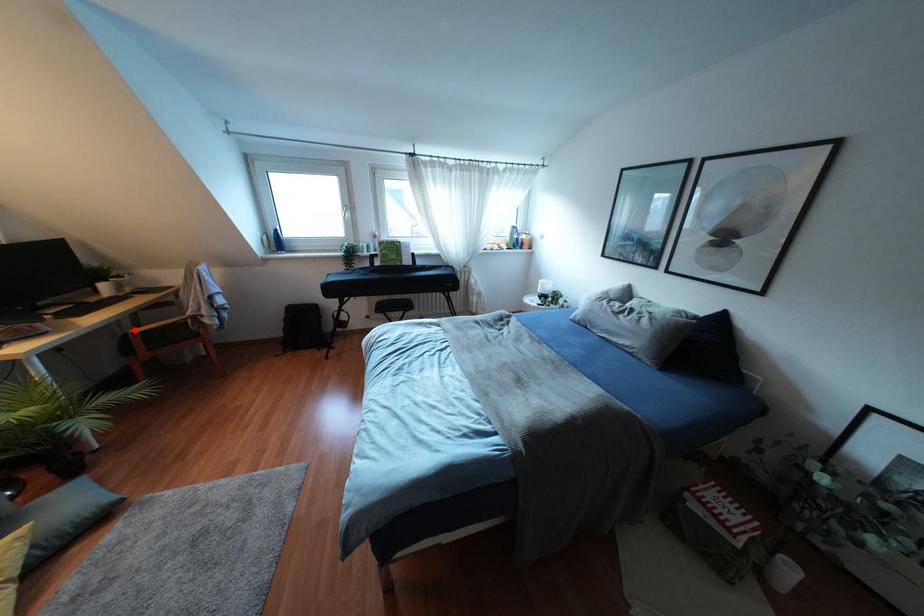
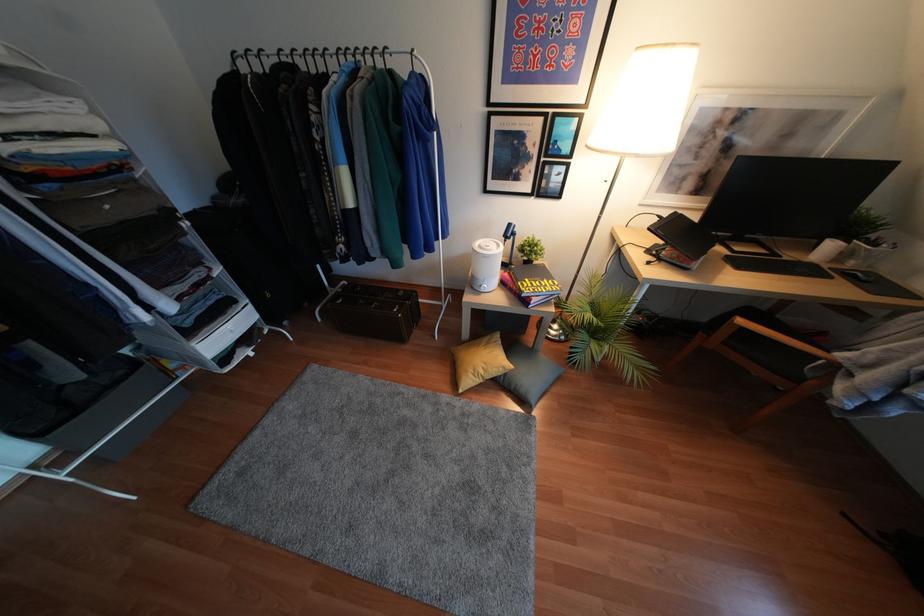
Question: I am providing you with two images of the same scene from different viewpoints. A red point is marked on the first image. At the location where the point appears in image 1, is it still visible in image 2?

Choices:
 (A) Yes
 (B) No

Answer: (A)